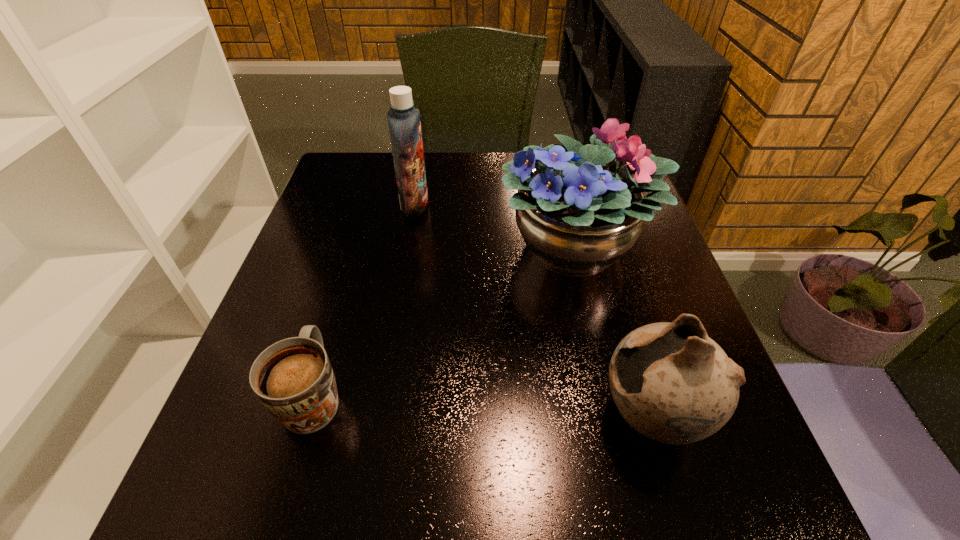
Where is `free space located on the side of the leftmost object with the handle`? The image size is (960, 540). free space located on the side of the leftmost object with the handle is located at coordinates 351,270.

Where is `vacant region located on the side of the leftmost object with the handle`? vacant region located on the side of the leftmost object with the handle is located at coordinates (344, 296).

Find the location of a particular element. vacant space positioned 0.170m on the side of the leftmost object with the handle is located at coordinates (346, 289).

In order to click on object at the far edge in this screenshot , I will do `click(404, 124)`.

I want to click on object located at the near edge, so click(x=672, y=383).

The width and height of the screenshot is (960, 540). I want to click on object at the left edge, so click(293, 378).

Where is `bouquet that is at the right edge`? The width and height of the screenshot is (960, 540). bouquet that is at the right edge is located at coordinates (577, 216).

Find the location of `pottery present at the right edge`. pottery present at the right edge is located at coordinates (672, 383).

Where is `object that is at the near right corner`? Image resolution: width=960 pixels, height=540 pixels. object that is at the near right corner is located at coordinates (672, 383).

Where is `vacant position at the far edge of the desktop`? vacant position at the far edge of the desktop is located at coordinates (468, 166).